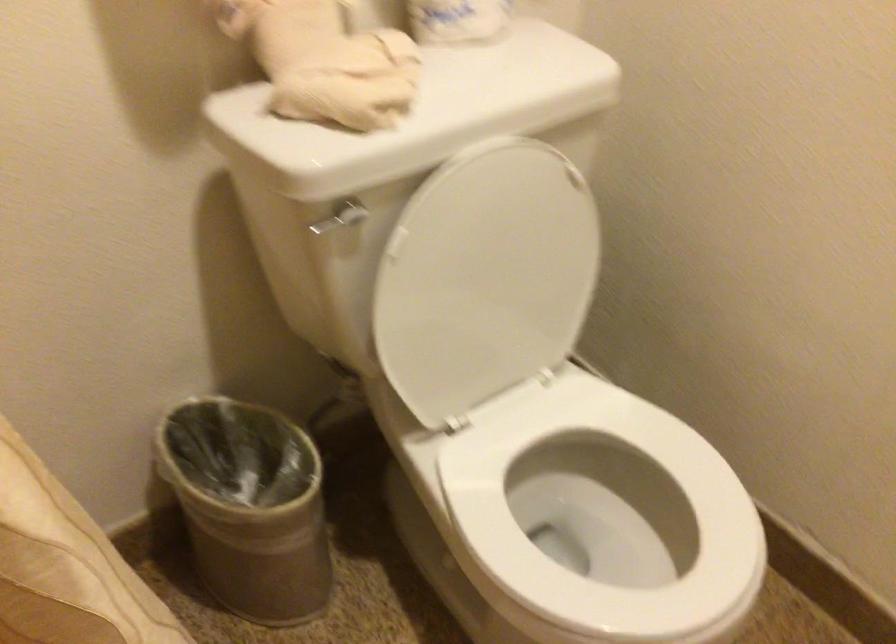
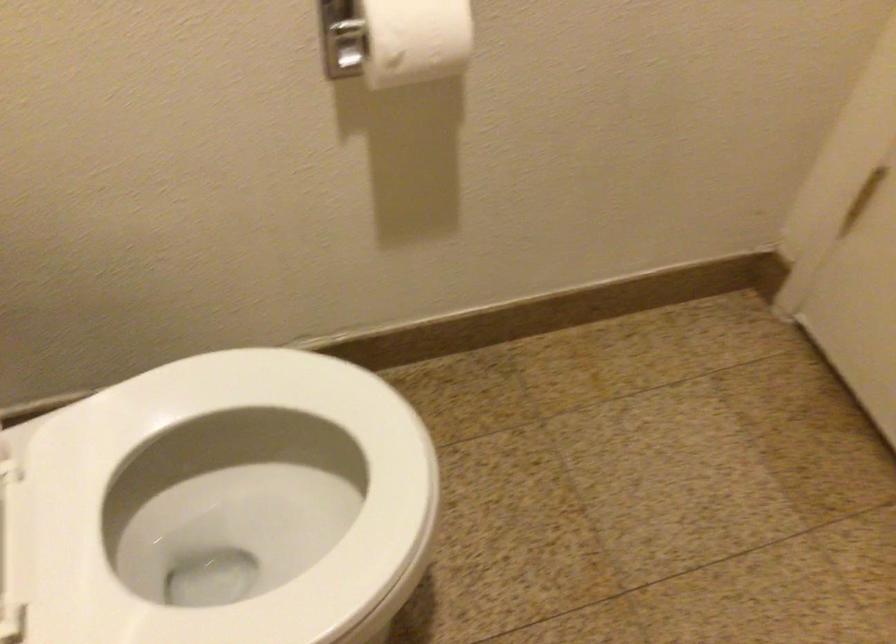
The first image is from the beginning of the video and the second image is from the end. How did the camera likely rotate when shooting the video?

The rotation direction of the camera is right-down.